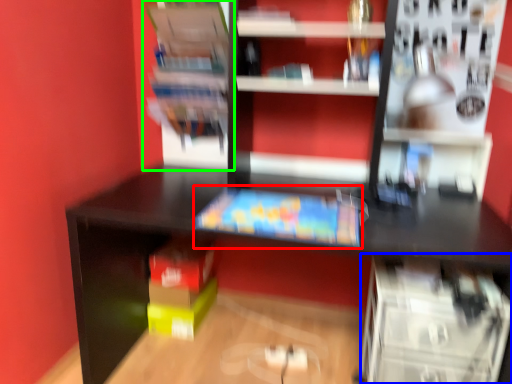
Question: Which object is positioned closest to book (highlighted by a red box)? Select from shelf (highlighted by a blue box) and shelf (highlighted by a green box).

Choices:
 (A) shelf
 (B) shelf

Answer: (A)